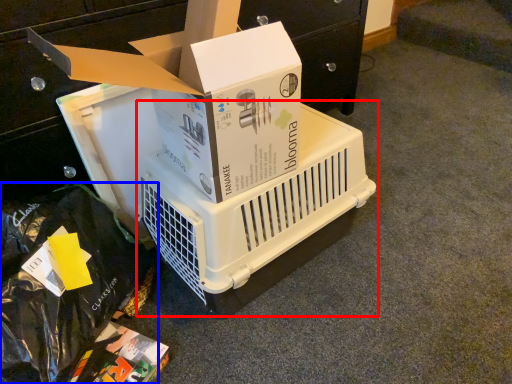
Question: Which object appears closest to the camera in this image, appliance (highlighted by a red box) or garbage (highlighted by a blue box)?

Choices:
 (A) appliance
 (B) garbage

Answer: (B)